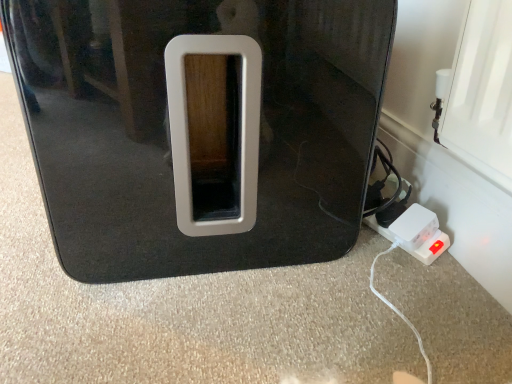
Find the location of a particular element. This screenshot has height=384, width=512. vacant space in front of black glossy mini-fridge at center is located at coordinates (182, 318).